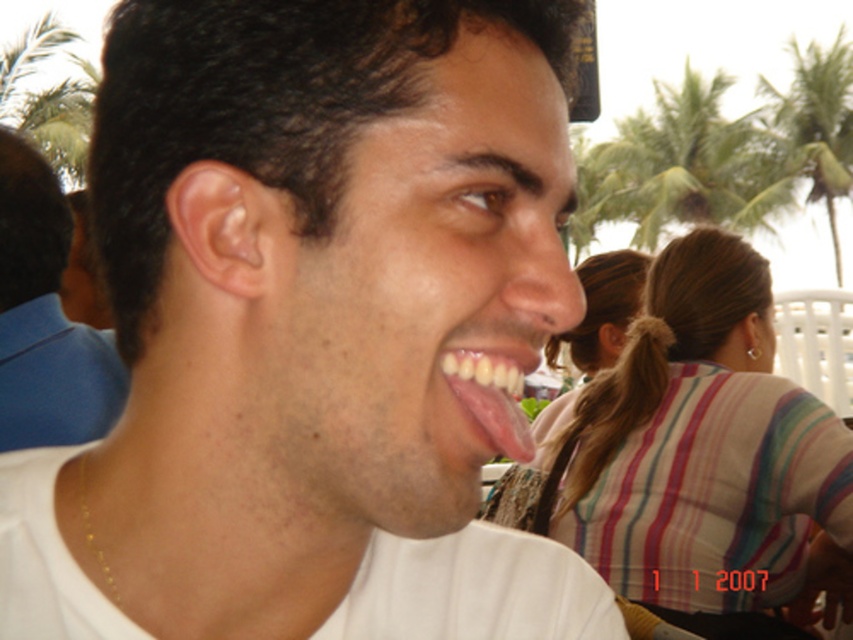
You are a photographer adjusting lighting for a portrait. You notice the matte white face at center and the matte white shirt at center in your frame. Which object should you focus your lighting adjustments on to ensure proper exposure, considering their size in the frame?

The matte white face at center has a lesser height compared to the matte white shirt at center, so you should focus your lighting adjustments on the matte white face at center since it is smaller and may require more precise exposure to avoid underexposure.

You are a photographer trying to capture a portrait of the man in the scene. The matte blue shirt at left and the green leafy palm tree at upper center are both visible in your frame. Since you want to focus on the man, which object should you adjust your camera to be closer to?

You should adjust your camera to be closer to the matte blue shirt at left because it is nearer to the photographer than the green leafy palm tree at upper center, which is farther away.

You are a photographer trying to capture the man in the image. You want to ensure both the pink glossy tongue at center and the green leafy palm tree at upper center are in focus. Given that your camera can only focus on objects within a 10 meter range of each other, will you need to adjust your focus settings?

The green leafy palm tree at upper center is 16.39 meters from the pink glossy tongue at center. Since the distance exceeds the 10 meter range, you will need to adjust your focus settings to accommodate the greater depth of field required.